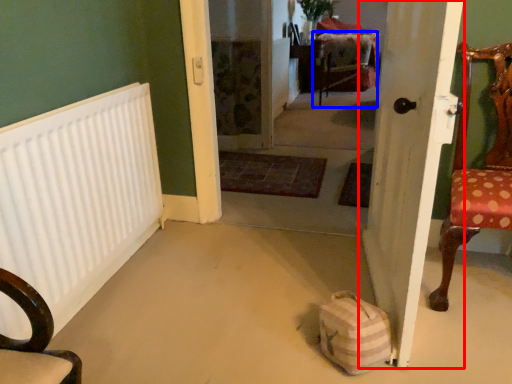
Question: Which point is further to the camera, door (highlighted by a red box) or armchair (highlighted by a blue box)?

Choices:
 (A) door
 (B) armchair

Answer: (B)